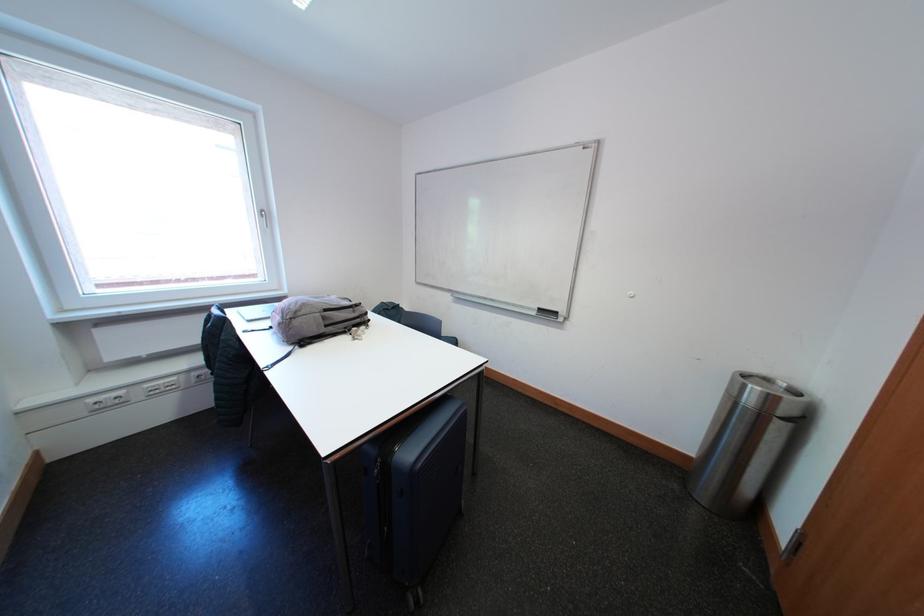
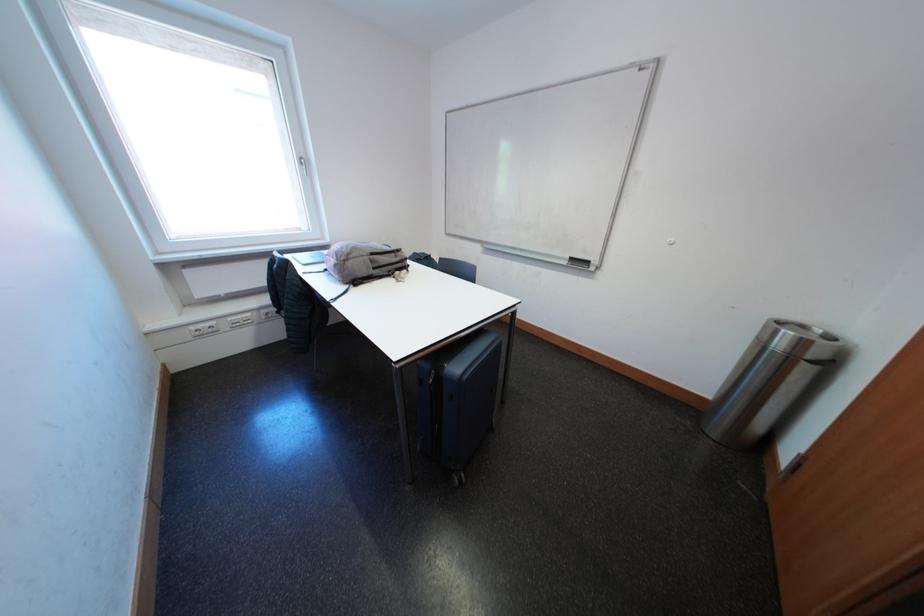
The point at (363, 315) is marked in the first image. Where is the corresponding point in the second image?

(406, 261)